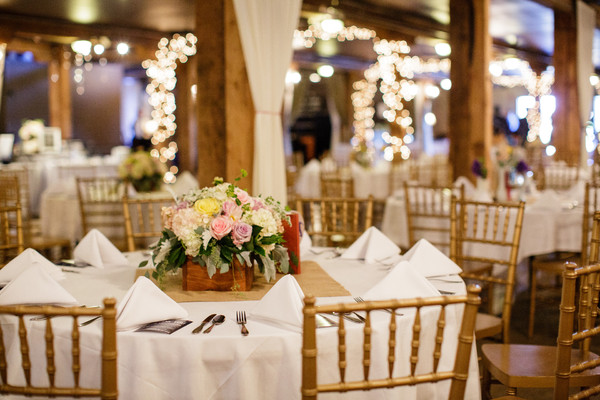
Locate an element on the screen. The width and height of the screenshot is (600, 400). flower bouquet is located at coordinates (232, 212), (139, 160).